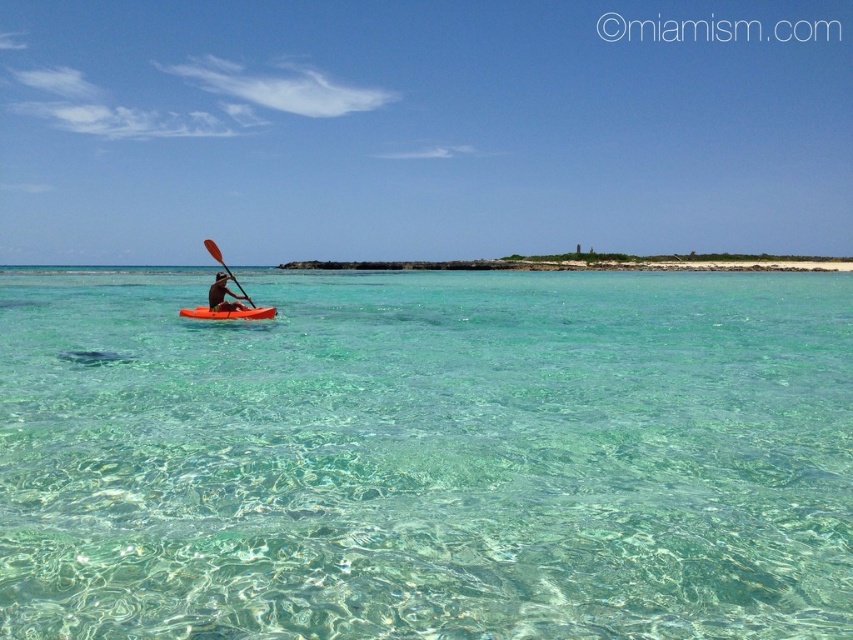
Question: Which object appears farthest from the camera in this image?

Choices:
 (A) wooden paddle at center
 (B) matte orange kayak at center

Answer: (A)

Question: Considering the real-world distances, which object is farthest from the orange plastic canoe at center?

Choices:
 (A) clear glassy water at center
 (B) matte orange kayak at center

Answer: (A)

Question: Estimate the real-world distances between objects in this image. Which object is farther from the wooden paddle at center?

Choices:
 (A) clear glassy water at center
 (B) orange plastic canoe at center

Answer: (A)

Question: Is orange plastic canoe at center behind matte orange kayak at center?

Choices:
 (A) no
 (B) yes

Answer: (A)

Question: Does clear glassy water at center have a smaller size compared to wooden paddle at center?

Choices:
 (A) no
 (B) yes

Answer: (A)

Question: Is orange plastic canoe at center smaller than wooden paddle at center?

Choices:
 (A) yes
 (B) no

Answer: (A)